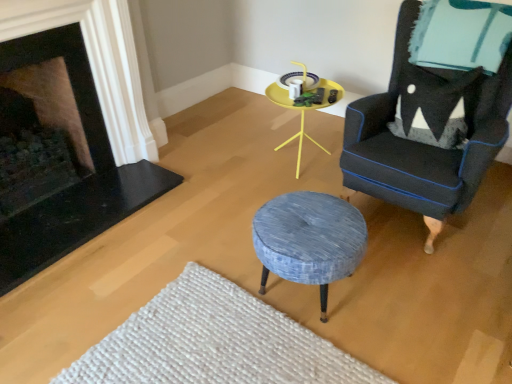
This screenshot has width=512, height=384. I want to click on empty space that is ontop of textured blue fabric stool at center (from a real-world perspective), so click(x=297, y=223).